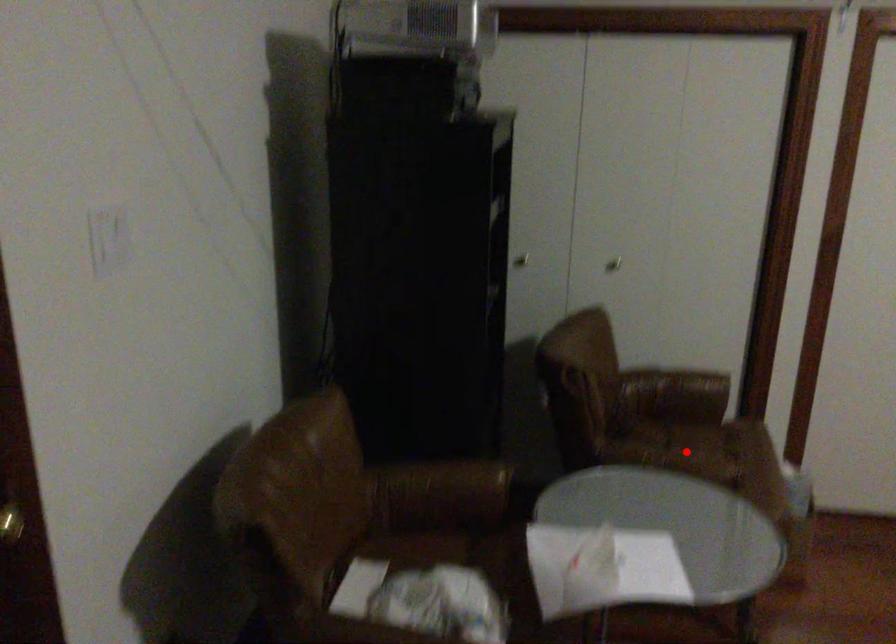
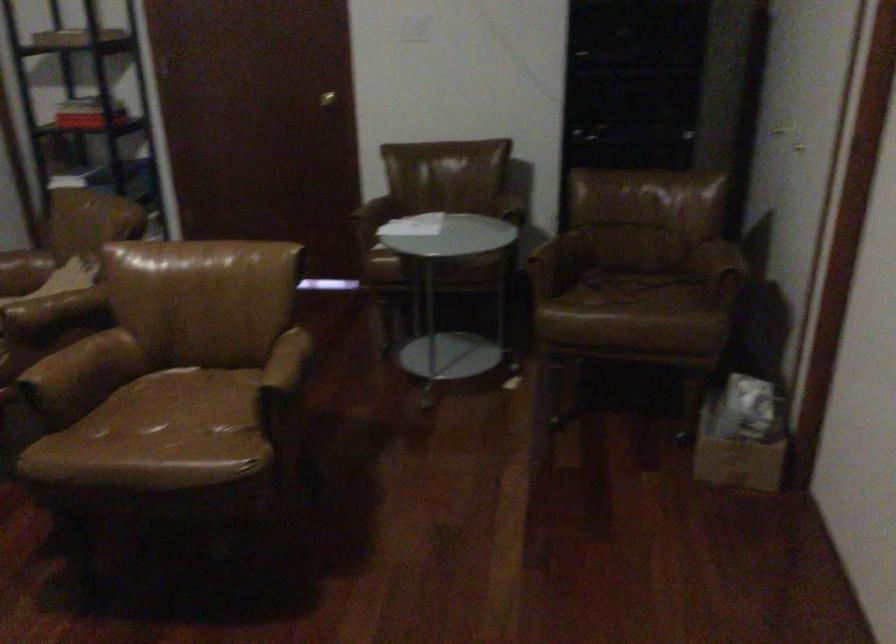
Where in the second image is the point corresponding to the highlighted location from the first image?

(627, 288)